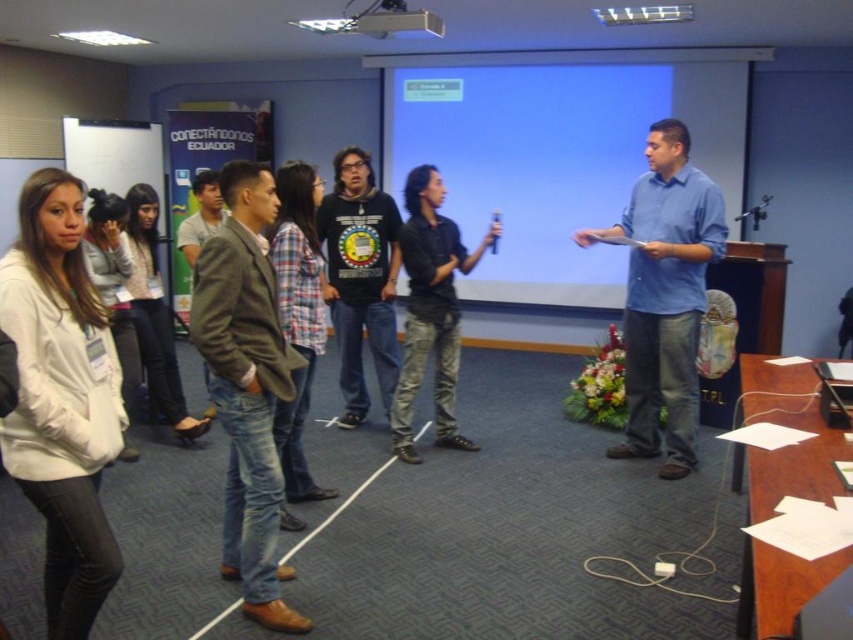
Who is more distant from viewer, [657,339] or [347,381]?

Positioned behind is point [347,381].

Does blue cotton shirt at center have a larger size compared to black matte t-shirt at center?

Yes.

Is point (685, 465) closer to camera compared to point (357, 348)?

That is True.

This screenshot has height=640, width=853. In order to click on blue cotton shirt at center in this screenshot , I will do tap(664, 296).

Is dark blue shirt at center below green textured jacket at center?

Yes, dark blue shirt at center is below green textured jacket at center.

Does dark blue shirt at center lie in front of green textured jacket at center?

Yes, dark blue shirt at center is closer to the viewer.

Does point (445, 396) come in front of point (198, 208)?

Yes, point (445, 396) is closer to viewer.

In order to click on dark blue shirt at center in this screenshot , I will do `click(431, 310)`.

Is blue cotton shirt at center to the left of green textured jacket at center from the viewer's perspective?

In fact, blue cotton shirt at center is to the right of green textured jacket at center.

Can you confirm if blue cotton shirt at center is wider than green textured jacket at center?

Yes.

Does point (683, 392) come closer to viewer compared to point (218, 209)?

Yes.

You are a GUI agent. You are given a task and a screenshot of the screen. Output one action in this format:
    pyautogui.click(x=<x>, y=<y>)
    Task: Click on the blue cotton shirt at center
    The image size is (853, 640).
    Given the screenshot: What is the action you would take?
    pyautogui.click(x=664, y=296)